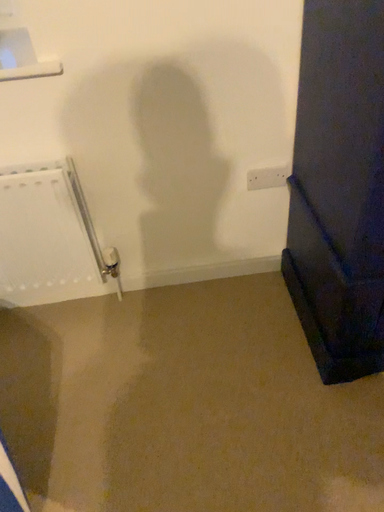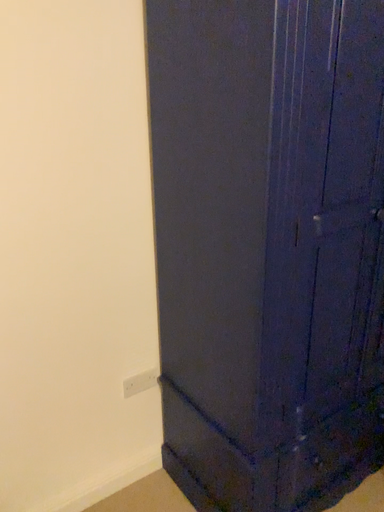
Question: How did the camera likely rotate when shooting the video?

Choices:
 (A) rotated upward
 (B) rotated downward

Answer: (A)